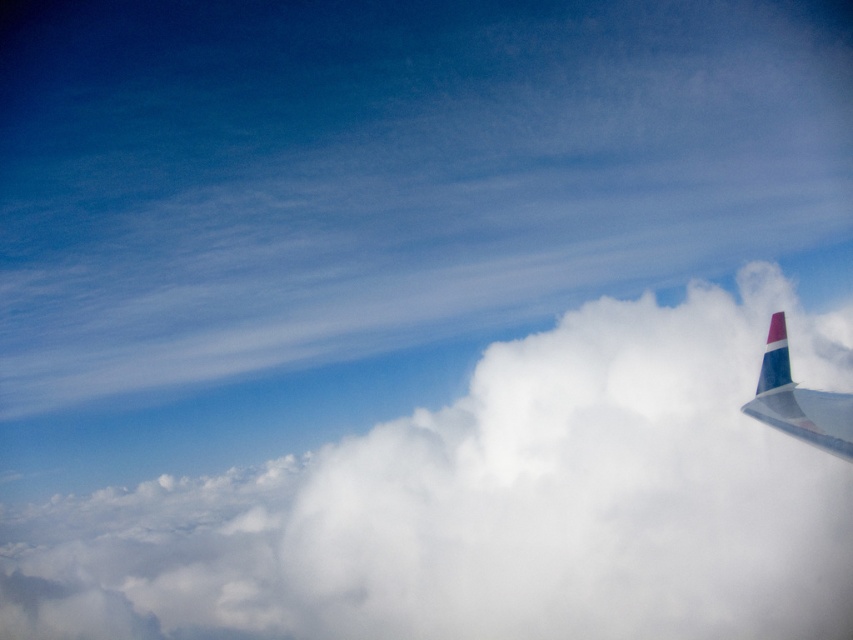
You are a passenger sitting in the aircraft and looking out the window. You see the white fluffy cloud at upper right and the polished aluminum winglet at upper right. Which object is closer to the window?

The polished aluminum winglet at upper right is closer to the window because the white fluffy cloud at upper right is located below it, meaning the winglet is in front.

You are a flight attendant checking the aircraft exterior from the cabin window. You notice the white fluffy cloud at upper right and the polished aluminum winglet at upper right. Which object is wider?

The white fluffy cloud at upper right might be wider than polished aluminum winglet at upper right according to the description.

You are a passenger sitting by the window and see the white fluffy cloud at upper right and the polished aluminum winglet at upper right. Which object is nearer to your seat?

The white fluffy cloud at upper right is closer to the viewer than the polished aluminum winglet at upper right, so the white fluffy cloud at upper right is nearer to your seat.